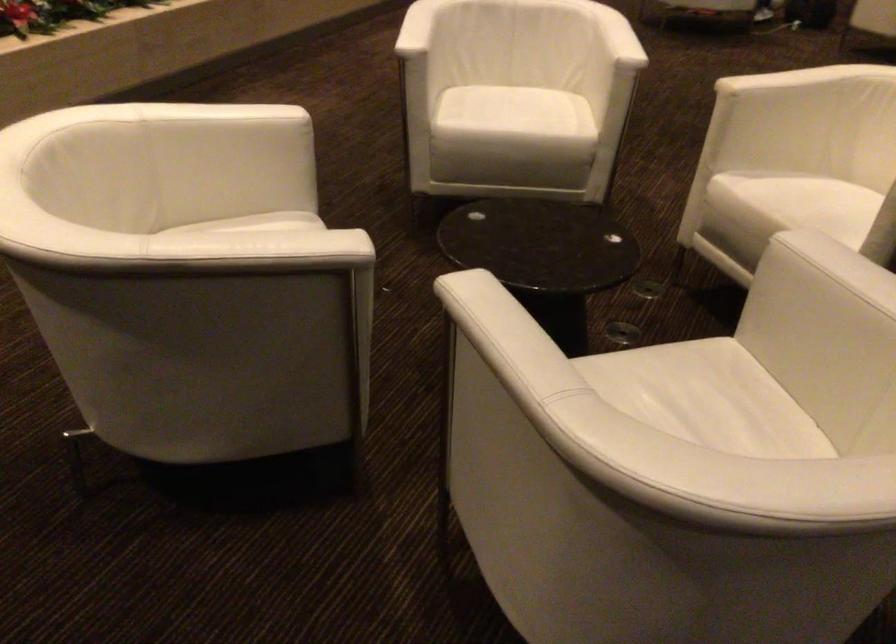
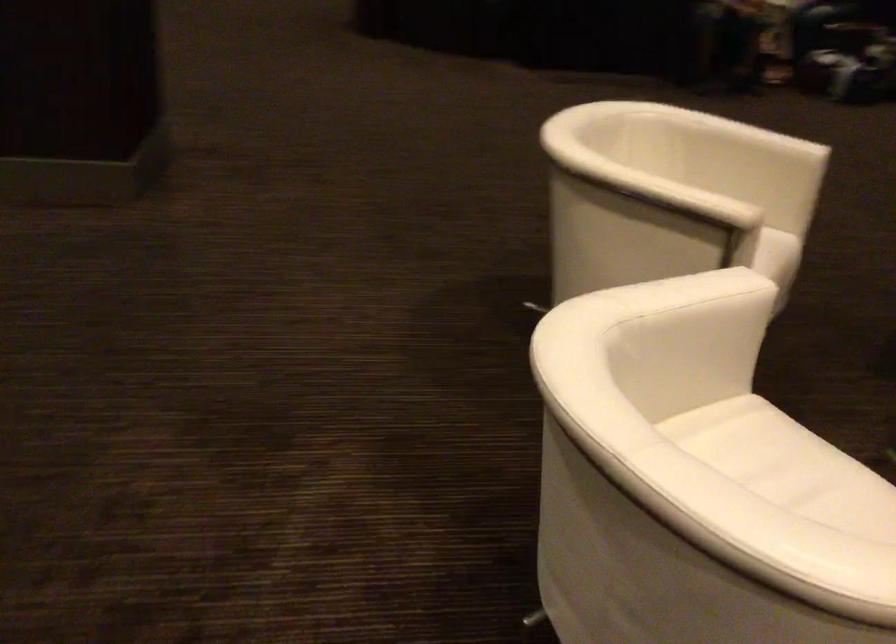
The point at [765,73] is marked in the first image. Where is the corresponding point in the second image?

(675, 194)